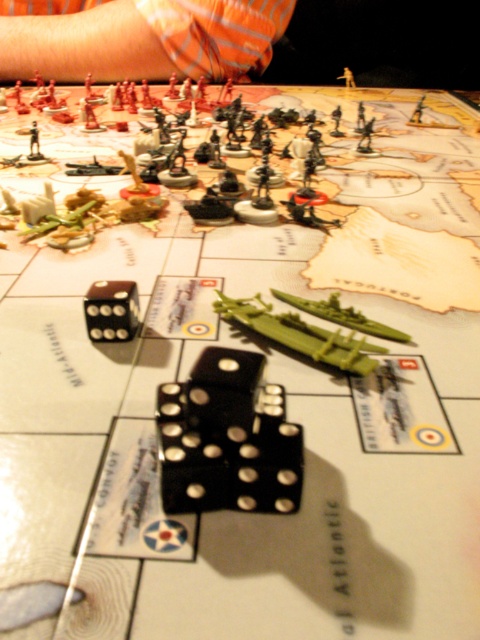
Question: Which point is closer to the camera?

Choices:
 (A) black rubber dice at center
 (B) orange striped shirt at upper left

Answer: (A)

Question: Is orange striped shirt at upper left bigger than black rubber dice at center?

Choices:
 (A) yes
 (B) no

Answer: (A)

Question: From the image, what is the correct spatial relationship of orange striped shirt at upper left in relation to black rubber dice at center?

Choices:
 (A) left
 (B) right

Answer: (A)

Question: Is orange striped shirt at upper left below black rubber dice at center?

Choices:
 (A) yes
 (B) no

Answer: (B)